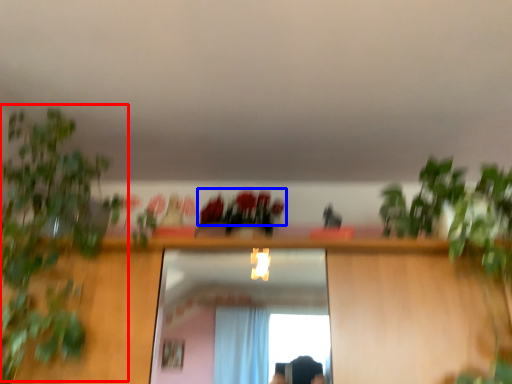
Question: Among these objects, which one is farthest to the camera, vegetation (highlighted by a red box) or flower (highlighted by a blue box)?

Choices:
 (A) vegetation
 (B) flower

Answer: (B)